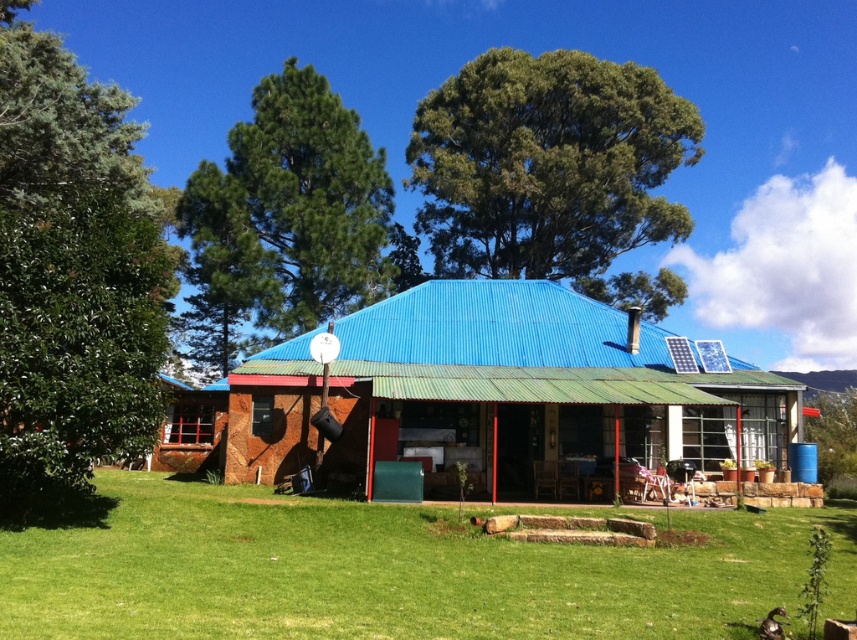
Question: Which object is the closest to the green grass at center?

Choices:
 (A) green leafy tree at upper center
 (B) green leafy tree at upper left
 (C) blue corrugated metal hut at center
 (D) green leafy tree at left

Answer: (C)

Question: From the image, what is the correct spatial relationship of green grass at center in relation to green leafy tree at upper center?

Choices:
 (A) above
 (B) below

Answer: (B)

Question: Does green leafy tree at upper center appear under green leafy tree at upper left?

Choices:
 (A) no
 (B) yes

Answer: (A)

Question: Which point is farther from the camera taking this photo?

Choices:
 (A) (783, 545)
 (B) (447, 368)
 (C) (223, 179)
 (D) (166, 275)

Answer: (C)

Question: Can you confirm if blue corrugated metal hut at center is positioned below green leafy tree at left?

Choices:
 (A) no
 (B) yes

Answer: (B)

Question: Which point is closer to the camera taking this photo?

Choices:
 (A) (651, 300)
 (B) (327, 477)
 (C) (295, 289)

Answer: (B)